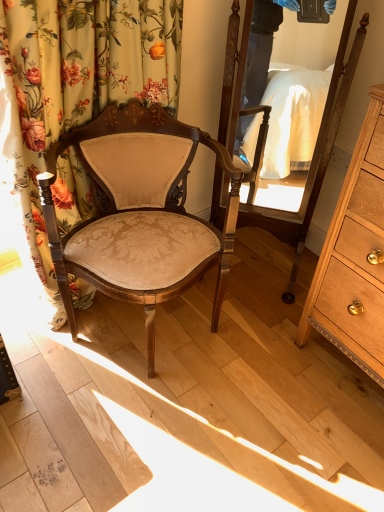
What are the coordinates of `matte beige fabric chair at center` in the screenshot? It's located at (141, 215).

What do you see at coordinates (141, 215) in the screenshot? I see `matte beige fabric chair at center` at bounding box center [141, 215].

Where is `light brown wood dresser at right`? This screenshot has width=384, height=512. light brown wood dresser at right is located at coordinates (354, 256).

Locate an element on the screen. matte beige fabric chair at center is located at coordinates (141, 215).

Considering the relative positions of wooden mirror at center and floral fabric curtain at left in the image provided, is wooden mirror at center to the left or to the right of floral fabric curtain at left?

Based on their positions, wooden mirror at center is located to the right of floral fabric curtain at left.

Is wooden mirror at center placed right next to floral fabric curtain at left?

wooden mirror at center is not next to floral fabric curtain at left, and they're not touching.

From a real-world perspective, between wooden mirror at center and floral fabric curtain at left, who is vertically higher?

wooden mirror at center is physically above.

From the image's perspective, does wooden mirror at center appear higher than floral fabric curtain at left?

Indeed, from the image's perspective, wooden mirror at center is shown above floral fabric curtain at left.

Which is nearer, (120, 260) or (222, 216)?

Point (120, 260) is closer to the camera than point (222, 216).

Is matte beige fabric chair at center beside wooden mirror at center?

No.

In the image, there is a wooden mirror at center. Where is `chair below it (from the image's perspective)`? The width and height of the screenshot is (384, 512). chair below it (from the image's perspective) is located at coordinates pyautogui.click(x=141, y=215).

Is matte beige fabric chair at center wider than wooden mirror at center?

Correct, the width of matte beige fabric chair at center exceeds that of wooden mirror at center.

Which object is positioned more to the left, wooden mirror at center or matte beige fabric chair at center?

matte beige fabric chair at center is more to the left.

Considering the relative sizes of wooden mirror at center and matte beige fabric chair at center in the image provided, is wooden mirror at center wider than matte beige fabric chair at center?

No, wooden mirror at center is not wider than matte beige fabric chair at center.

Is wooden mirror at center inside or outside of matte beige fabric chair at center?

The correct answer is: outside.

Between wooden mirror at center and matte beige fabric chair at center, which one is positioned in front?

matte beige fabric chair at center is closer to the camera.

Is point (352, 258) in front of point (303, 237)?

Yes, it is in front of point (303, 237).

From a real-world perspective, which is physically below, light brown wood dresser at right or wooden mirror at center?

light brown wood dresser at right is physically lower.

Between light brown wood dresser at right and wooden mirror at center, which one has smaller size?

wooden mirror at center.

Which object is positioned more to the right, light brown wood dresser at right or wooden mirror at center?

light brown wood dresser at right.

From a real-world perspective, who is located higher, floral fabric curtain at left or light brown wood dresser at right?

In real-world perspective, floral fabric curtain at left is above.

From the image's perspective, is floral fabric curtain at left below light brown wood dresser at right?

No, from the image's perspective, floral fabric curtain at left is not below light brown wood dresser at right.

In the scene shown: Is floral fabric curtain at left positioned with its back to light brown wood dresser at right?

No, floral fabric curtain at left is not facing away from light brown wood dresser at right.

What's the angular difference between floral fabric curtain at left and light brown wood dresser at right's facing directions?

There is a 95.2-degree angle between the facing directions of floral fabric curtain at left and light brown wood dresser at right.

Consider the image. Is wooden mirror at center to the right of light brown wood dresser at right from the viewer's perspective?

In fact, wooden mirror at center is to the left of light brown wood dresser at right.

Which object is wider, wooden mirror at center or light brown wood dresser at right?

light brown wood dresser at right is wider.

Considering the sizes of wooden mirror at center and light brown wood dresser at right in the image, is wooden mirror at center taller or shorter than light brown wood dresser at right?

wooden mirror at center is taller than light brown wood dresser at right.

You are a GUI agent. You are given a task and a screenshot of the screen. Output one action in this format:
    pyautogui.click(x=<x>, y=<y>)
    Task: Click on the mirror above the light brown wood dresser at right (from the image's perspective)
    The height and width of the screenshot is (512, 384).
    Given the screenshot: What is the action you would take?
    pyautogui.click(x=313, y=156)

What's the angular difference between light brown wood dresser at right and matte beige fabric chair at center's facing directions?

The facing directions of light brown wood dresser at right and matte beige fabric chair at center are 71.9 degrees apart.

Does light brown wood dresser at right turn towards matte beige fabric chair at center?

No.

In terms of height, does light brown wood dresser at right look taller or shorter compared to matte beige fabric chair at center?

Clearly, light brown wood dresser at right is taller compared to matte beige fabric chair at center.

Measure the distance between light brown wood dresser at right and matte beige fabric chair at center.

A distance of 20.06 inches exists between light brown wood dresser at right and matte beige fabric chair at center.

The height and width of the screenshot is (512, 384). Identify the location of curtain that appears below the wooden mirror at center (from the image's perspective). (74, 91).

This screenshot has width=384, height=512. What are the coordinates of `mirror above the matte beige fabric chair at center (from a real-world perspective)` in the screenshot? It's located at pyautogui.click(x=313, y=156).

Looking at the image, which one is located further to floral fabric curtain at left, matte beige fabric chair at center or light brown wood dresser at right?

light brown wood dresser at right is positioned further to the anchor floral fabric curtain at left.

Based on their spatial positions, is floral fabric curtain at left or wooden mirror at center closer to light brown wood dresser at right?

Among the two, wooden mirror at center is located nearer to light brown wood dresser at right.

Based on their spatial positions, is matte beige fabric chair at center or light brown wood dresser at right closer to wooden mirror at center?

matte beige fabric chair at center is closer to wooden mirror at center.

From the image, which object appears to be nearer to matte beige fabric chair at center, floral fabric curtain at left or light brown wood dresser at right?

floral fabric curtain at left is positioned closer to the anchor matte beige fabric chair at center.

Which object lies further to the anchor point light brown wood dresser at right, floral fabric curtain at left or matte beige fabric chair at center?

floral fabric curtain at left is further to light brown wood dresser at right.

Looking at the image, which one is located closer to light brown wood dresser at right, matte beige fabric chair at center or wooden mirror at center?

wooden mirror at center.

Which object lies further to the anchor point matte beige fabric chair at center, wooden mirror at center or floral fabric curtain at left?

The object further to matte beige fabric chair at center is wooden mirror at center.

Consider the image. Estimate the real-world distances between objects in this image. Which object is closer to light brown wood dresser at right, wooden mirror at center or matte beige fabric chair at center?

Among the two, wooden mirror at center is located nearer to light brown wood dresser at right.

I want to click on chair situated between floral fabric curtain at left and wooden mirror at center from left to right, so click(x=141, y=215).

Find the location of a particular element. chair between floral fabric curtain at left and light brown wood dresser at right from left to right is located at coordinates (141, 215).

Identify the location of mirror located between floral fabric curtain at left and light brown wood dresser at right in the left-right direction. The width and height of the screenshot is (384, 512). (313, 156).

This screenshot has height=512, width=384. Identify the location of mirror between matte beige fabric chair at center and light brown wood dresser at right in the horizontal direction. (313, 156).